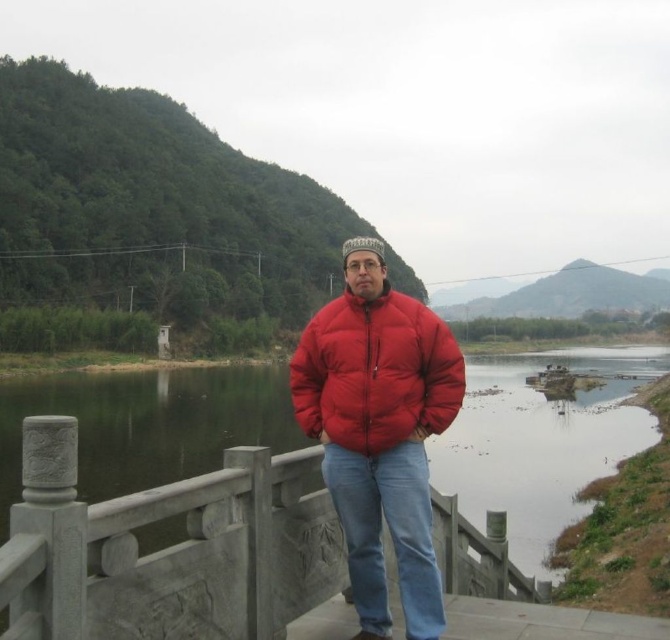
Does point (360, 467) come farther from viewer compared to point (413, 385)?

No, it is in front of (413, 385).

From the picture: Who is more forward, (438, 419) or (346, 324)?

Point (438, 419) is more forward.

Who is more distant from viewer, (360,316) or (342,332)?

The point (360,316) is more distant.

The width and height of the screenshot is (670, 640). What are the coordinates of `red puffy jacket at center` in the screenshot? It's located at (379, 429).

Which is in front, point (330, 545) or point (401, 346)?

Point (401, 346)

Does gray stone railing at center have a lesser width compared to red down jacket at center?

Indeed, gray stone railing at center has a lesser width compared to red down jacket at center.

This screenshot has width=670, height=640. Identify the location of gray stone railing at center. (165, 548).

You are a GUI agent. You are given a task and a screenshot of the screen. Output one action in this format:
    pyautogui.click(x=<x>, y=<y>)
    Task: Click on the gray stone railing at center
    This screenshot has height=640, width=670.
    Given the screenshot: What is the action you would take?
    pyautogui.click(x=165, y=548)

Is the position of gray stone railing at center less distant than that of red puffy jacket at center?

That is True.

Can you confirm if gray stone railing at center is smaller than red puffy jacket at center?

Yes, gray stone railing at center is smaller than red puffy jacket at center.

Does point (151, 634) come behind point (423, 336)?

That is False.

Locate an element on the screen. The height and width of the screenshot is (640, 670). gray stone railing at center is located at coordinates (165, 548).